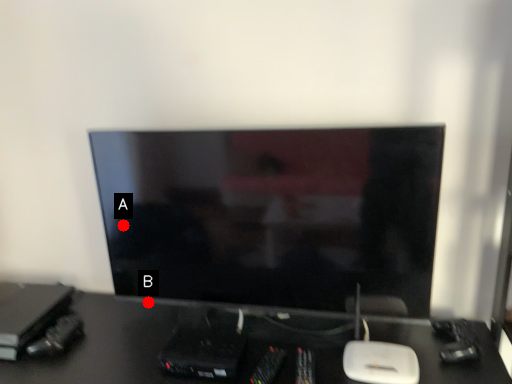
Question: Two points are circled on the image, labeled by A and B beside each circle. Which point is closer to the camera?

Choices:
 (A) A is closer
 (B) B is closer

Answer: (A)